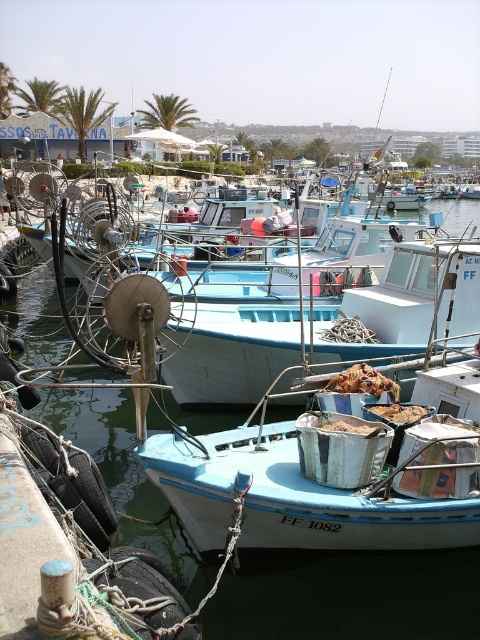
You are a photographer planning to take a photo of the light blue painted wood boat at center and the white matte boat at center. You want to ensure both boats are visible in the frame. Based on their positions, which boat should you place on the left side of your camera frame to include both?

The light blue painted wood boat at center is positioned on the left side of white matte boat at center, so to include both in the frame, you should place the light blue painted wood boat at center on the left side of your camera frame and the white matte boat at center on the right side.

You are a marine biologist observing the marina. You need to determine which object has a narrower width between the white matte boat at center and the blue water at center. Which one is it?

The white matte boat at center is thinner than blue water at center, so the white matte boat at center has a narrower width.

You are standing at the edge of the marina and want to take a photo that includes both the small fishing boat painted in light blue with white trim and the large metal bucket filled with sand or soil on its deck. The camera you are using has a limited field of view. Which of the two points, point 1 at coordinates point (241, 472) or point 2 at coordinates point (407, 605), is closer to the camera and thus more likely to be fully captured in the photo?

Point 1 at coordinates point (241, 472) is closer to the camera than point 2 at coordinates point (407, 605), so it is more likely to be fully captured in the photo.